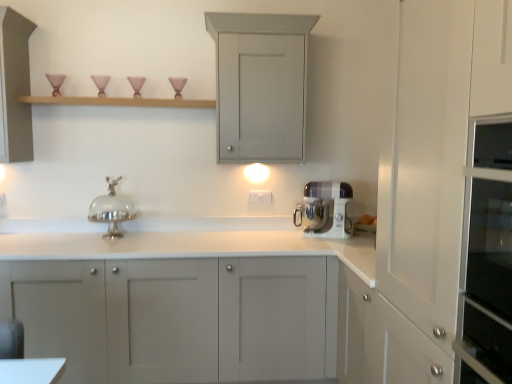
Question: In terms of height, does matte gray cabinet at upper center, which is counted as the 1th cabinetry, starting from the top, look taller or shorter compared to wooden shelf at upper center?

Choices:
 (A) short
 (B) tall

Answer: (B)

Question: From the image's perspective, is matte gray cabinet at upper center, positioned as the third cabinetry in bottom-to-top order, located above or below wooden shelf at upper center?

Choices:
 (A) below
 (B) above

Answer: (B)

Question: Which is nearer to the matte gray cabinet at upper center, positioned as the third cabinetry in bottom-to-top order?

Choices:
 (A) silver metallic cake stand at center
 (B) wooden shelf at upper center
 (C) white plastic stand mixer at center
 (D) matte gray cabinet at center, the third cabinetry viewed from the top
 (E) matte gray cabinet at left, which appears as the 2th cabinetry when viewed from the top

Answer: (B)

Question: Estimate the real-world distances between objects in this image. Which object is closer to the silver metallic cake stand at center?

Choices:
 (A) white plastic stand mixer at center
 (B) wooden shelf at upper center
 (C) matte gray cabinet at center, marked as the first cabinetry in a bottom-to-top arrangement
 (D) matte gray cabinet at left, which appears as the 2th cabinetry when viewed from the top
 (E) matte gray cabinet at upper center, positioned as the third cabinetry in bottom-to-top order

Answer: (B)